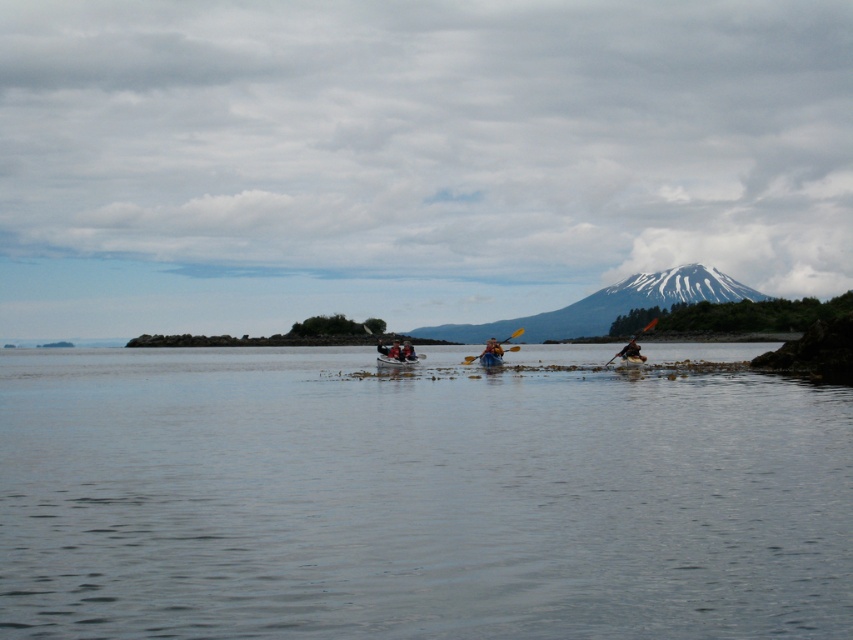
Is smooth plastic paddle at center below wooden paddle at center?

Incorrect, smooth plastic paddle at center is not positioned below wooden paddle at center.

Is point (410, 356) closer to camera compared to point (473, 360)?

That is True.

The width and height of the screenshot is (853, 640). What are the coordinates of `smooth plastic paddle at center` in the screenshot? It's located at [x=396, y=348].

Does point (497, 364) lie in front of point (509, 337)?

Yes, point (497, 364) is in front of point (509, 337).

Is blue plastic canoe at center thinner than blue plastic paddle at center?

Indeed, blue plastic canoe at center has a lesser width compared to blue plastic paddle at center.

I want to click on blue plastic canoe at center, so click(491, 358).

Which is behind, point (630, 340) or point (399, 353)?

The point (399, 353) is behind.

Image resolution: width=853 pixels, height=640 pixels. I want to click on wooden paddle at right, so click(630, 349).

Between point (624, 348) and point (398, 346), which one is positioned in front?

Point (624, 348) is more forward.

Locate an element on the screen. Image resolution: width=853 pixels, height=640 pixels. wooden paddle at right is located at coordinates (630, 349).